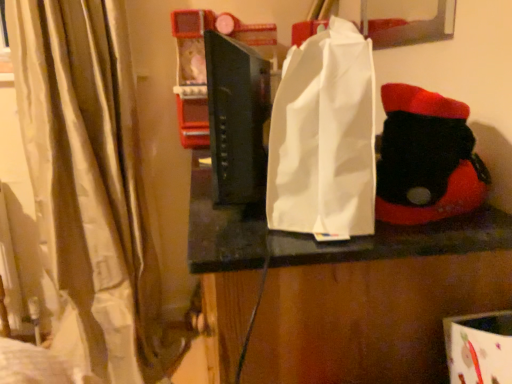
Question: Is white paper bag at center spatially inside black matte book at center, or outside of it?

Choices:
 (A) outside
 (B) inside

Answer: (A)

Question: From the image's perspective, is white paper bag at center above or below black matte book at center?

Choices:
 (A) above
 (B) below

Answer: (B)

Question: Estimate the real-world distances between objects in this image. Which object is closer to the white paper bag at center?

Choices:
 (A) beige fabric curtain at left
 (B) white paper bag at center
 (C) black matte book at center
 (D) black felt boot at right

Answer: (D)

Question: Which is farther from the white paper bag at center?

Choices:
 (A) black matte book at center
 (B) white paper bag at center
 (C) beige fabric curtain at left
 (D) black felt boot at right

Answer: (C)